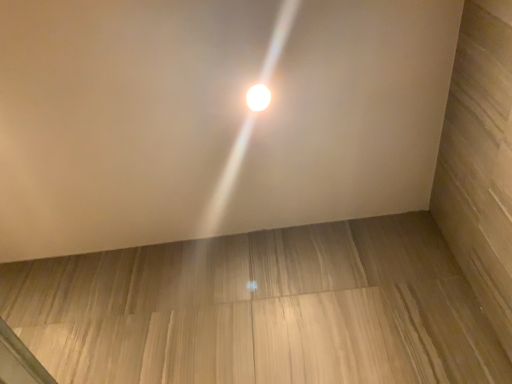
At what (x,y) coordinates should I click in order to perform the action: click on vacant space behind white glossy light bulb at upper center. Please return your answer as a coordinate pair (x, y). Looking at the image, I should click on (258, 155).